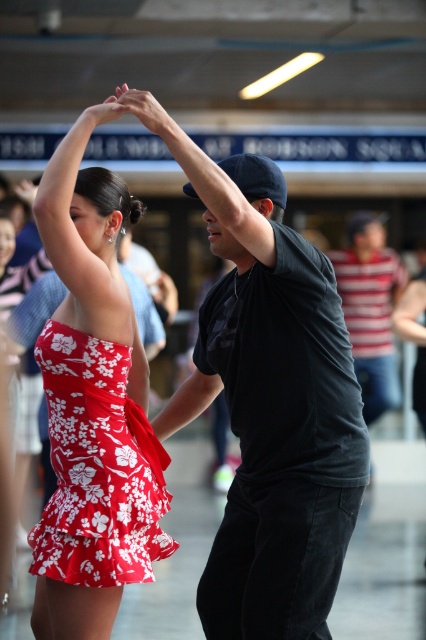
You are a photographer at a dance event. You need to position your camera to capture both the red floral fabric dress at center and the striped cotton shirt at right in the same frame. Based on their positions, which side of the camera should you focus on to include both subjects?

The red floral fabric dress at center is to the left of the striped cotton shirt at right, so focusing the camera on the center area between the left and right sides will ensure both subjects are captured in the frame.